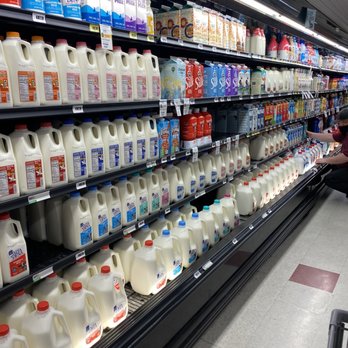
Where is `half gallons of milk on the third shelf`? Image resolution: width=348 pixels, height=348 pixels. half gallons of milk on the third shelf is located at coordinates (12, 183), (33, 176), (55, 171), (85, 166), (98, 160), (116, 159), (128, 155), (141, 151), (153, 149).